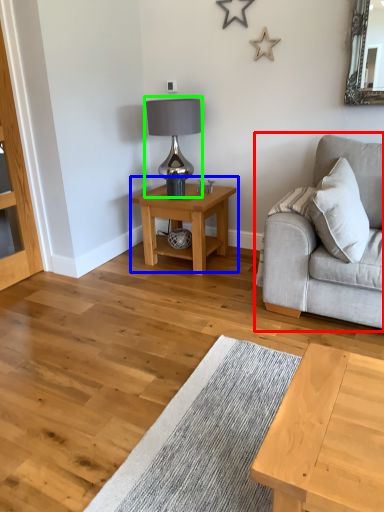
Question: Which object is positioned closest to studio couch (highlighted by a red box)? Select from table (highlighted by a blue box) and table lamp (highlighted by a green box).

Choices:
 (A) table
 (B) table lamp

Answer: (A)